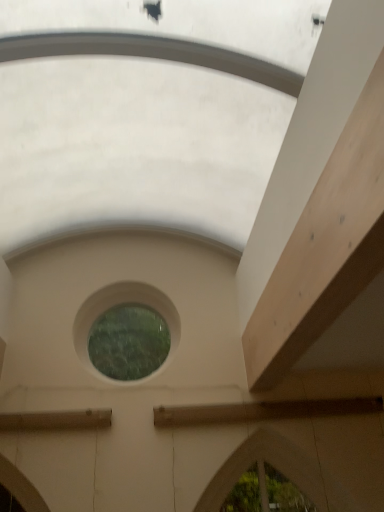
Describe the element at coordinates (117, 304) in the screenshot. I see `clear glass window at center` at that location.

You are a GUI agent. You are given a task and a screenshot of the screen. Output one action in this format:
    pyautogui.click(x=<x>, y=<y>)
    Task: Click on the clear glass window at center
    The width and height of the screenshot is (384, 512).
    Given the screenshot: What is the action you would take?
    pyautogui.click(x=117, y=304)

Locate an element on the screen. clear glass window at center is located at coordinates (117, 304).